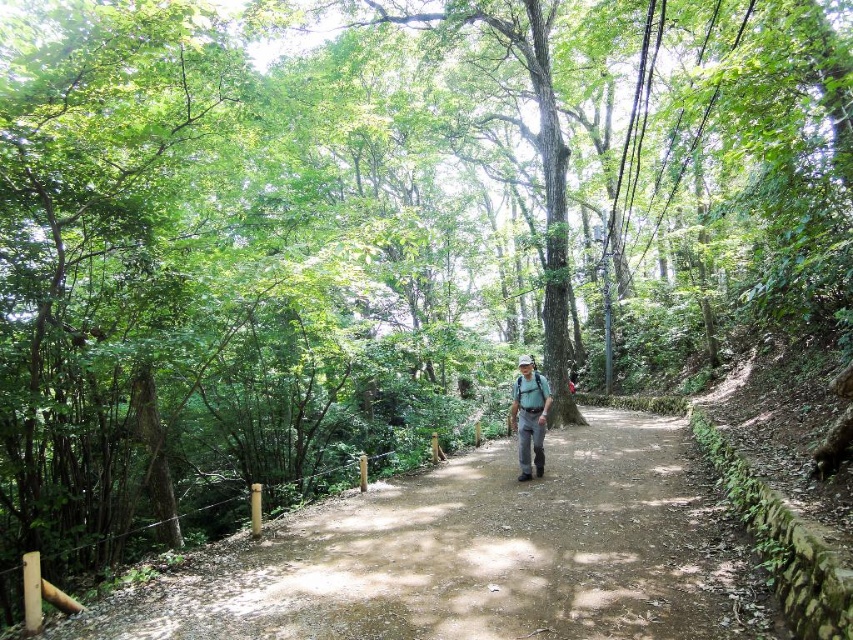
From the picture: You are standing at the starting point of the forest path and want to reach both the point at coordinates point (438, 476) and point (531, 419). Which point should you reach first if you want to minimize the distance walked?

You should reach point (438, 476) first because it is closer to you than point (531, 419), as it is further to the viewer.

Consider the image. You are a hiker carrying a camouflage fabric backpack at center and want to walk along the dirt path at center. Can you walk on the path without the backpack blocking your view of the path ahead?

The dirt path at center is in front of camouflage fabric backpack at center, so the backpack is behind you. This means you can walk on the dirt path at center without the backpack blocking your view of the path ahead.